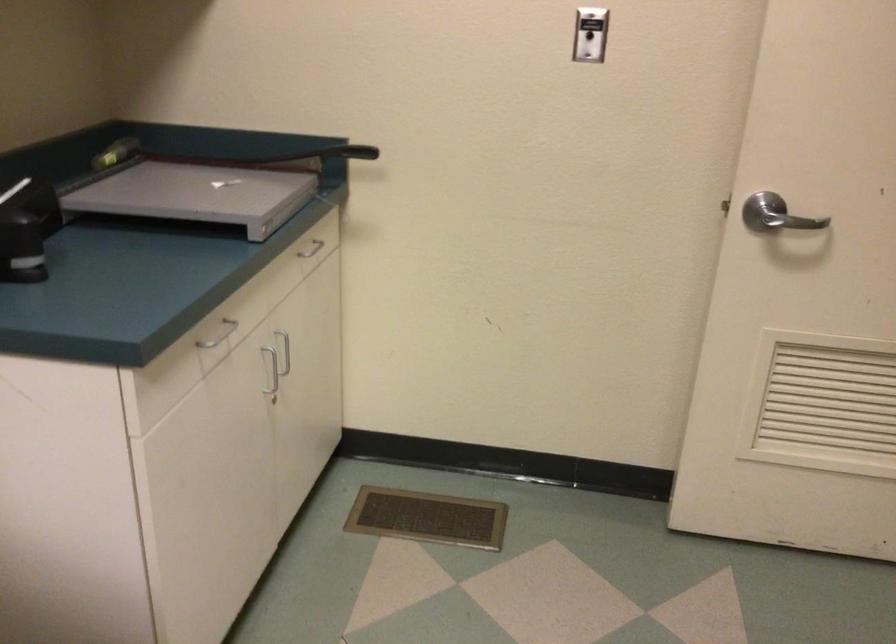
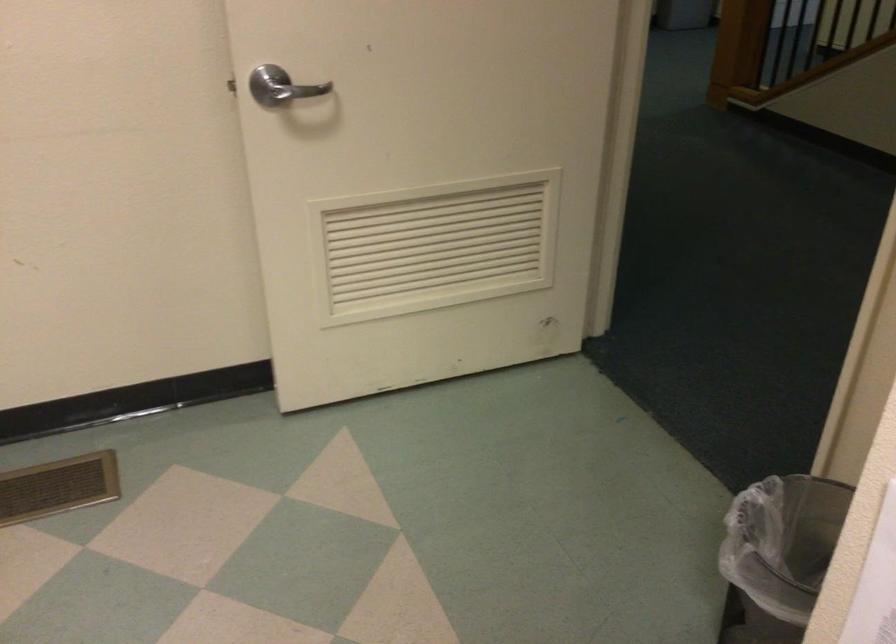
Locate, in the second image, the point that corresponds to (754,205) in the first image.

(270, 86)